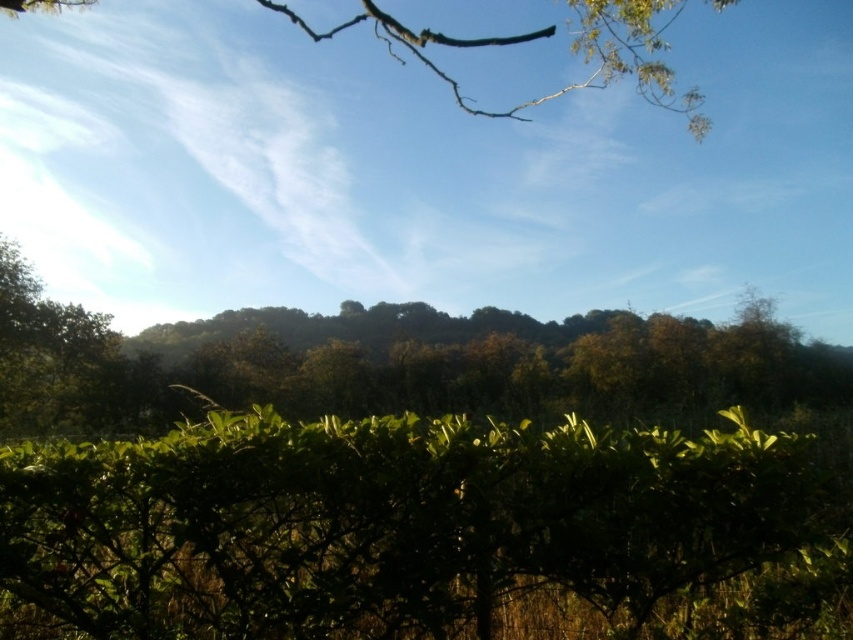
You are a gardener planning to trim both the green leafy hedge at lower center and the green leafy branch at upper center. Which of the two requires a longer ladder to reach its top?

The green leafy branch at upper center requires a longer ladder because it has a greater height compared to the green leafy hedge at lower center.

You are standing in a garden and want to take a photo of the green leafy hedge at lower center. If your camera can focus on objects up to 2 meters away, will it be able to capture the hedge clearly?

The green leafy hedge at lower center is 2.22 meters away from the viewer, which is beyond the camera focus range of 2 meters. Therefore, the camera may not capture the hedge clearly.